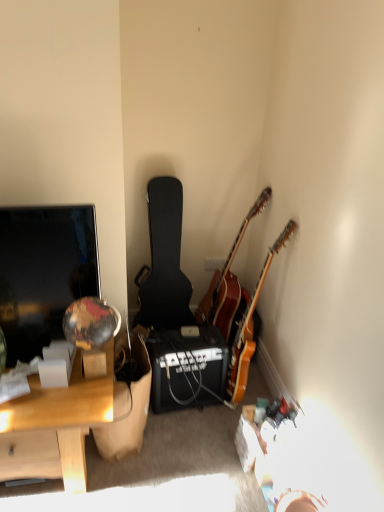
Question: Is wooden desk at left oriented towards black textured guitar case at center, the 3th guitar viewed from the right?

Choices:
 (A) yes
 (B) no

Answer: (B)

Question: From the image's perspective, does wooden desk at left appear lower than black textured guitar case at center, the 3th guitar viewed from the right?

Choices:
 (A) yes
 (B) no

Answer: (A)

Question: Is wooden desk at left far from black textured guitar case at center, which is the 1th guitar in left-to-right order?

Choices:
 (A) no
 (B) yes

Answer: (A)

Question: Is wooden desk at left closer to camera compared to black textured guitar case at center, which is the 1th guitar in left-to-right order?

Choices:
 (A) yes
 (B) no

Answer: (A)

Question: Can you confirm if wooden desk at left is positioned to the right of black textured guitar case at center, which is the 1th guitar in left-to-right order?

Choices:
 (A) no
 (B) yes

Answer: (A)

Question: Does point (231, 403) appear closer or farther from the camera than point (139, 302)?

Choices:
 (A) farther
 (B) closer

Answer: (B)

Question: In the image, is wooden acoustic guitar at upper right, the first guitar positioned from the right, on the left side or the right side of black textured guitar case at center, the 3th guitar viewed from the right?

Choices:
 (A) right
 (B) left

Answer: (A)

Question: Considering their positions, is wooden acoustic guitar at upper right, the first guitar positioned from the right, located in front of or behind black textured guitar case at center, which is the 1th guitar in left-to-right order?

Choices:
 (A) behind
 (B) front

Answer: (B)

Question: From the image's perspective, is wooden acoustic guitar at upper right, marked as the third guitar in a left-to-right arrangement, positioned above or below black textured guitar case at center, which is the 1th guitar in left-to-right order?

Choices:
 (A) above
 (B) below

Answer: (B)

Question: Looking at the image, does matte black screen at left seem bigger or smaller compared to wooden desk at left?

Choices:
 (A) big
 (B) small

Answer: (B)

Question: Considering the positions of matte black screen at left and wooden desk at left in the image, is matte black screen at left wider or thinner than wooden desk at left?

Choices:
 (A) wide
 (B) thin

Answer: (B)

Question: Is matte black screen at left taller or shorter than wooden desk at left?

Choices:
 (A) short
 (B) tall

Answer: (B)

Question: Would you say matte black screen at left is inside or outside wooden desk at left?

Choices:
 (A) inside
 (B) outside

Answer: (B)

Question: From a real-world perspective, is black matte amplifier at center above or below matte black screen at left?

Choices:
 (A) above
 (B) below

Answer: (B)

Question: Visually, is black matte amplifier at center positioned to the left or to the right of matte black screen at left?

Choices:
 (A) left
 (B) right

Answer: (B)